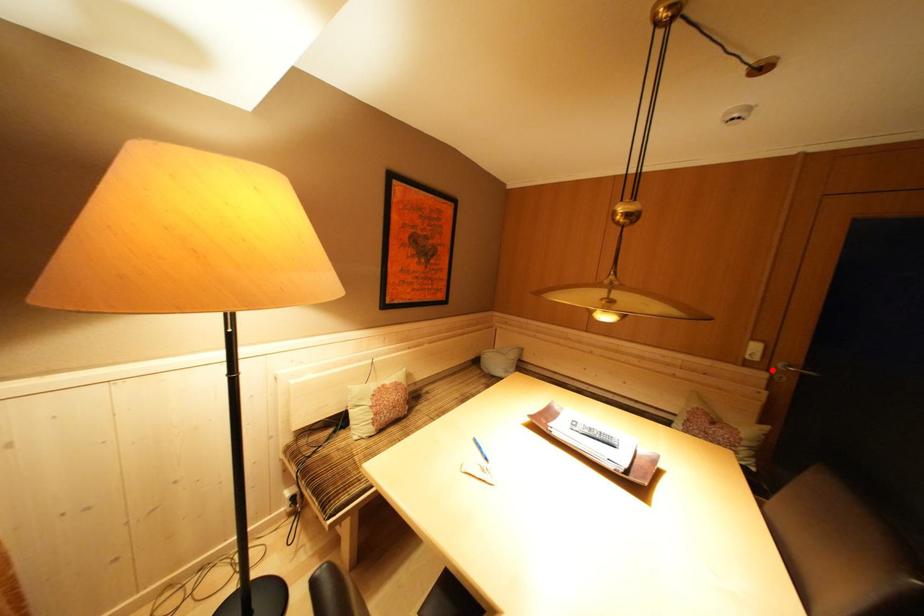
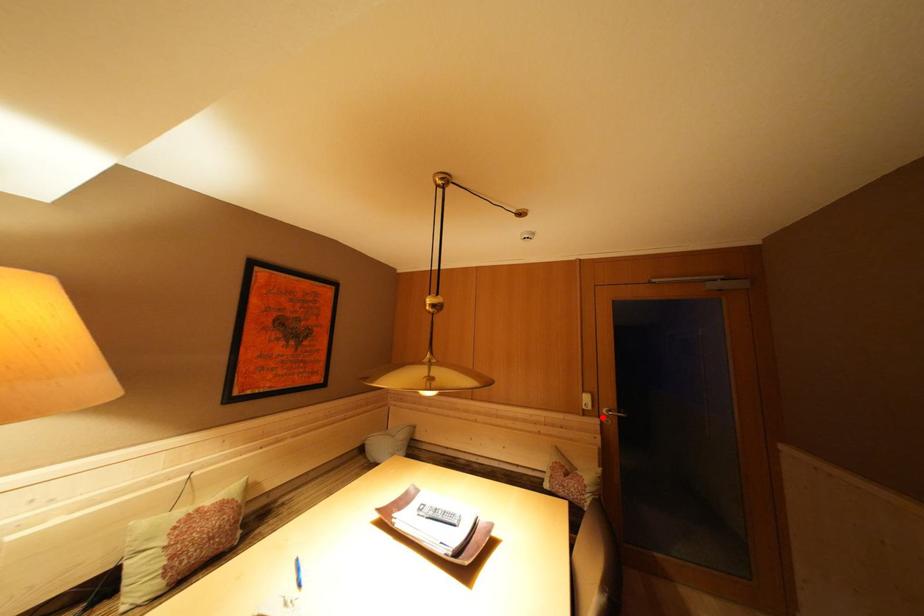
I am providing you with two images of the same scene from different viewpoints. A red point is marked on the first image and another point is marked on the second image. Is the red point in image1 aligned with the point shown in image2?

Yes